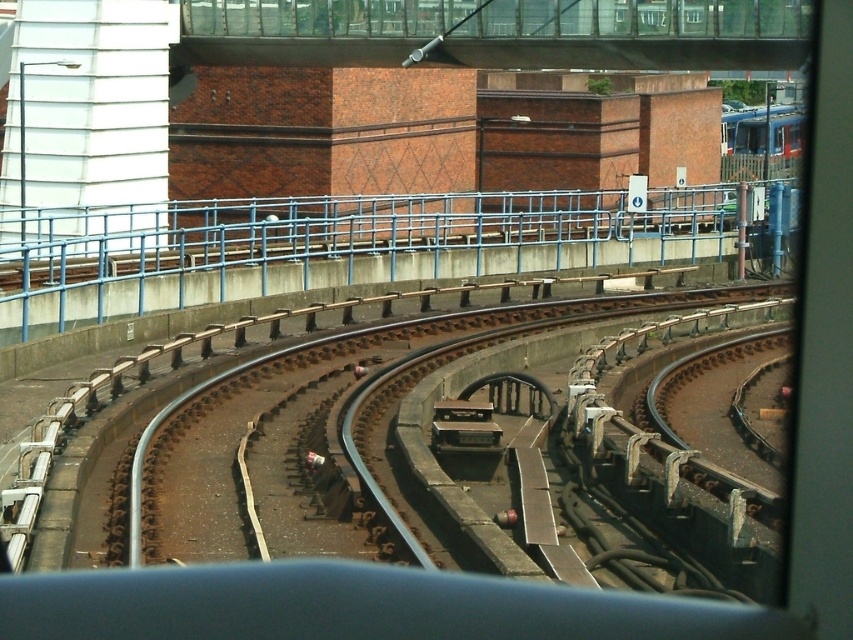
You are an engineer inspecting the railway system. You notice the blue metallic rail at upper center and the blue metallic train at upper right. Which object is closer to the starting point of the track?

The blue metallic rail at upper center is closer to the starting point of the track because it is positioned to the left of the blue metallic train at upper right, and the tracks curve to the right before continuing straight, indicating the rail is ahead in the track path.

You are a maintenance worker tasked with ensuring the safety of the blue metallic train at upper right as it travels along the tracks. The train must stay within the blue metallic rail at upper center for guidance. Given that the rail is wider than the train, will the train fit safely within the rail?

The blue metallic rail at upper center is wider than the blue metallic train at upper right, so the train will fit safely within the rail.

You are a maintenance worker checking the railway system. You notice the blue metallic rail at upper center and the blue metallic train at upper right. Which object is larger in size?

The blue metallic rail at upper center is bigger than the blue metallic train at upper right according to the description.